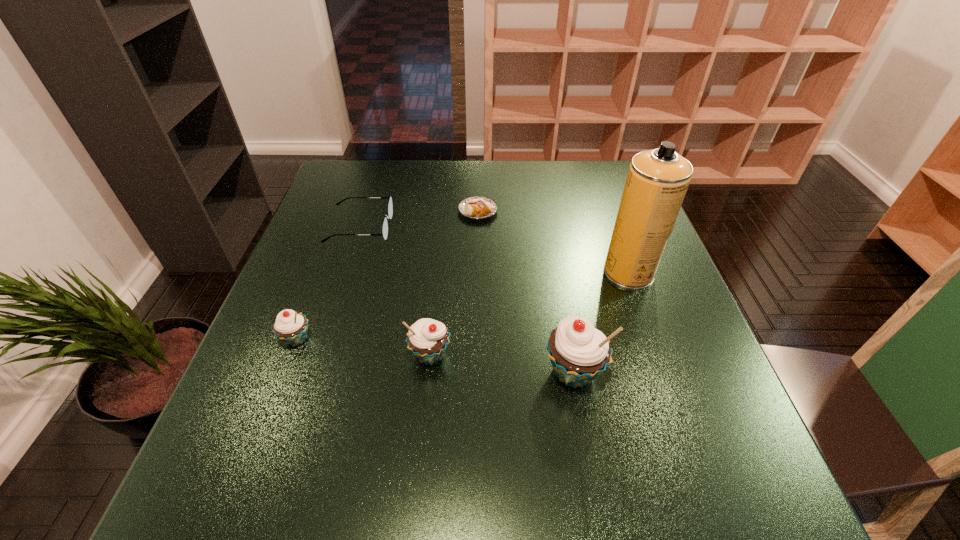
Locate an element on the screen. Image resolution: width=960 pixels, height=540 pixels. free point between the aerosol can and the pastry is located at coordinates (x=553, y=241).

I want to click on empty location between the third farthest object and the shortest object, so click(553, 241).

Identify the location of vacant region between the spectacles and the leftmost cupcake. (328, 283).

This screenshot has width=960, height=540. What are the coordinates of `unoccupied area between the third shortest object and the second shortest cupcake` in the screenshot? It's located at (364, 347).

The height and width of the screenshot is (540, 960). I want to click on free space between the aerosol can and the fourth shortest object, so click(530, 314).

Find the location of `free space between the second tallest cupcake and the third shortest object`. free space between the second tallest cupcake and the third shortest object is located at coordinates (364, 347).

Find the location of a particular element. This screenshot has height=540, width=960. free point between the tallest cupcake and the second cupcake from left to right is located at coordinates (502, 364).

Select which object is the fourth closest to the leftmost cupcake. Please provide its 2D coordinates. Your answer should be formatted as a tuple, i.e. [(x, y)], where the tuple contains the x and y coordinates of a point satisfying the conditions above.

[(578, 352)]

Choose which object is the nearest neighbor to the fourth nearest object. Please provide its 2D coordinates. Your answer should be formatted as a tuple, i.e. [(x, y)], where the tuple contains the x and y coordinates of a point satisfying the conditions above.

[(578, 352)]

Choose which cupcake is the second nearest neighbor to the pastry. Please provide its 2D coordinates. Your answer should be formatted as a tuple, i.e. [(x, y)], where the tuple contains the x and y coordinates of a point satisfying the conditions above.

[(578, 352)]